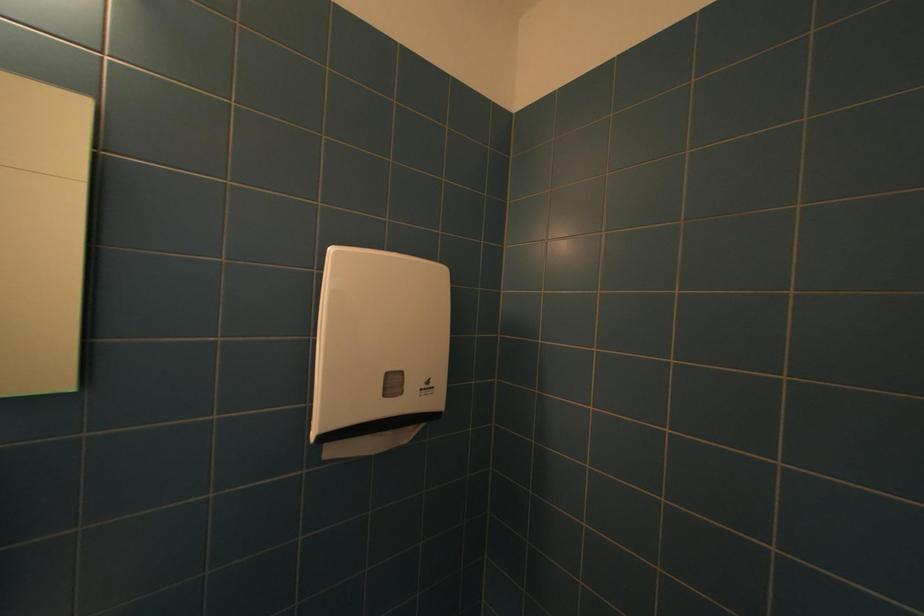
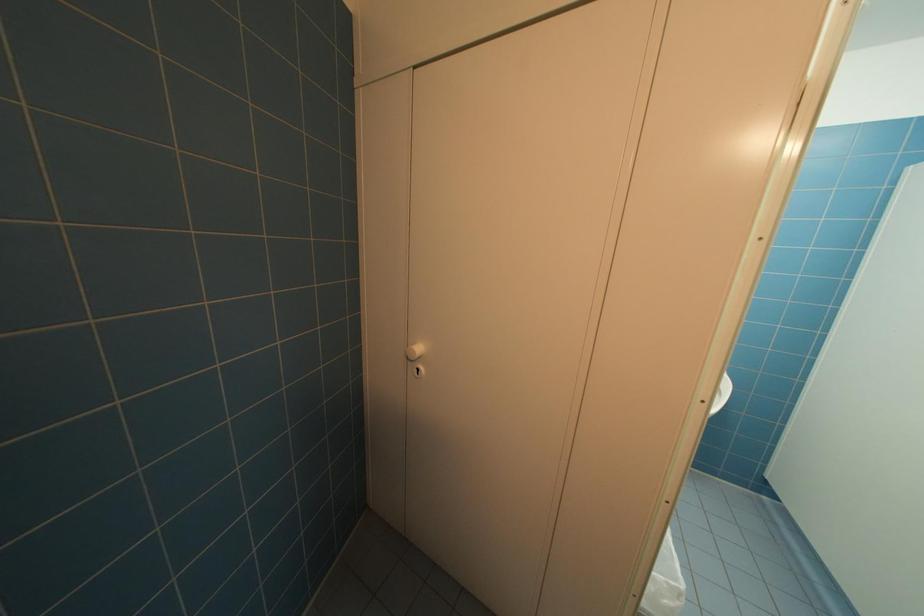
How did the camera likely rotate?

The camera's rotation is toward right-down.